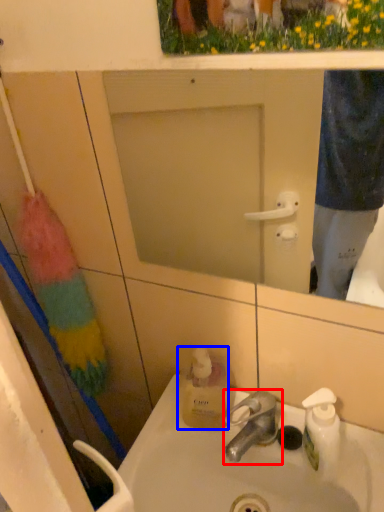
Question: Among these objects, which one is nearest to the camera, tap (highlighted by a red box) or bottle (highlighted by a blue box)?

Choices:
 (A) tap
 (B) bottle

Answer: (A)